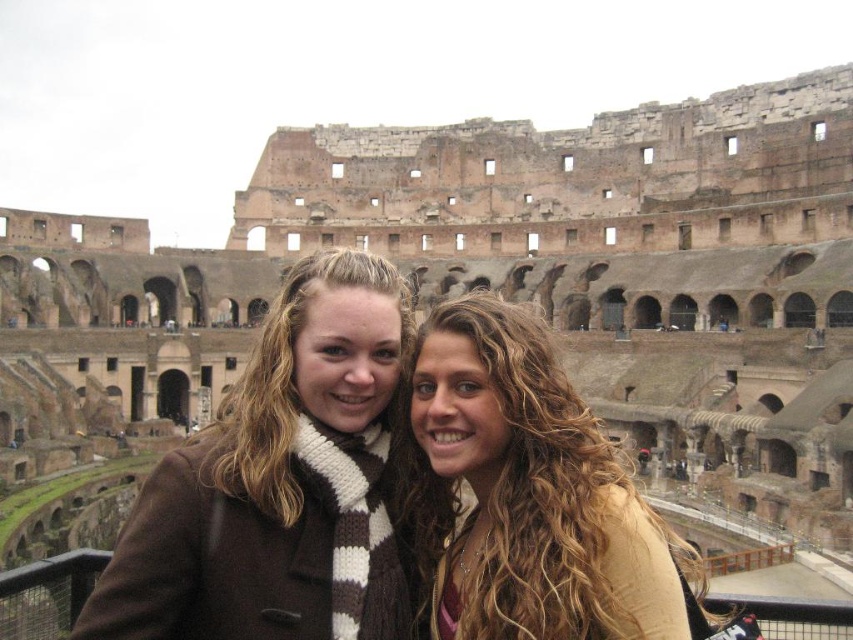
Is point (194, 502) in front of point (254, 436)?

Yes, it is in front of point (254, 436).

Can you confirm if brown woolen scarf at center is smaller than brown knitted scarf at center?

Actually, brown woolen scarf at center might be larger than brown knitted scarf at center.

Is point (363, 474) less distant than point (247, 435)?

That is False.

The image size is (853, 640). Find the location of `brown woolen scarf at center`. brown woolen scarf at center is located at coordinates (277, 484).

Can you confirm if brown woolen scarf at center is positioned below curly hair at center?

No, brown woolen scarf at center is not below curly hair at center.

Is point (357, 525) positioned before point (442, 515)?

Yes, point (357, 525) is closer to viewer.

What do you see at coordinates (277, 484) in the screenshot? I see `brown woolen scarf at center` at bounding box center [277, 484].

You are a GUI agent. You are given a task and a screenshot of the screen. Output one action in this format:
    pyautogui.click(x=<x>, y=<y>)
    Task: Click on the brown woolen scarf at center
    The image size is (853, 640).
    Given the screenshot: What is the action you would take?
    pyautogui.click(x=277, y=484)

Who is more distant from viewer, (585, 586) or (283, 288)?

The point (283, 288) is behind.

Where is `curly hair at center`? curly hair at center is located at coordinates (525, 492).